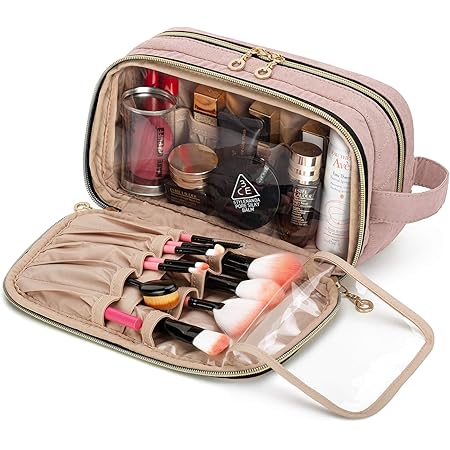
Image resolution: width=450 pixels, height=450 pixels. I want to click on make up brushes, so click(198, 345), click(229, 312), click(246, 283), click(271, 267), click(218, 245), click(214, 252), click(205, 264), click(200, 270).